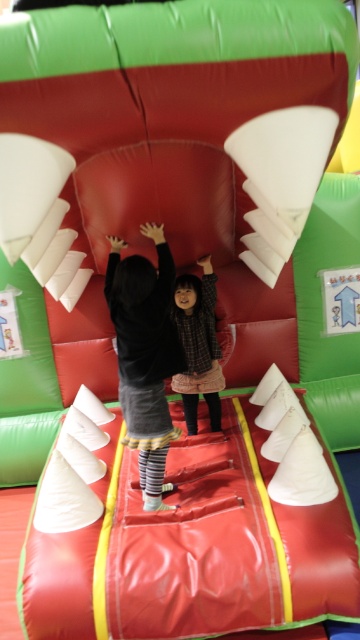
You are a photographer trying to capture the child in the black fleece jacket at center. The camera has a focus point at coordinate point (145, 353). Will the focus point be on the child in the black fleece jacket at center?

The black fleece jacket at center is located at point (145, 353), so yes, the focus point at coordinate point (145, 353) will be on the child in the black fleece jacket at center.

You are a photographer setting up for a family photo. You need to ensure both the black fleece jacket at center and the plaid fabric dress at center are clearly visible in the shot. Given their height difference, where should you position your camera to capture both effectively?

The black fleece jacket at center is much taller than the plaid fabric dress at center. To capture both effectively, position the camera at a lower angle so that the taller jacket doesn t block the view of the shorter dress.

You are a photographer trying to capture the best angle of the obstacle course. You notice two points marked on the image at coordinates point (132, 428) and point (200, 330). Which point should you focus on to ensure it appears larger in your photo?

Point (132, 428) is closer to the camera than point (200, 330), so focusing on point (132, 428) will make it appear larger in the photo.